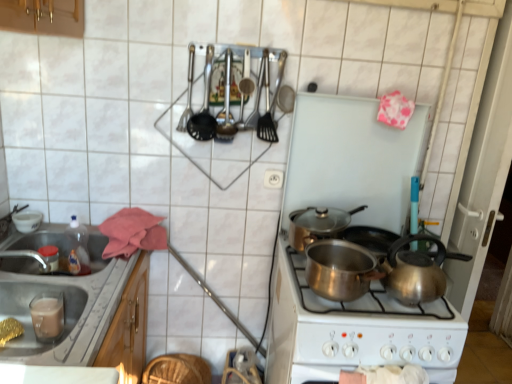
Question: From their relative heights in the image, would you say shiny metallic kettle at center right is taller or shorter than satin silver pot at center, which appears as the 1th kitchen appliance when viewed from the front?

Choices:
 (A) short
 (B) tall

Answer: (B)

Question: Is shiny metallic kettle at center right wider or thinner than satin silver pot at center, the 2th kitchen appliance from the top?

Choices:
 (A) thin
 (B) wide

Answer: (A)

Question: Estimate the real-world distances between objects in this image. Which object is farther from the golden textured bread at lower left?

Choices:
 (A) satin silver pot at center, arranged as the 1th kitchen appliance when ordered from the bottom
 (B) white plastic electric outlet at center
 (C) metallic stainless steel sink at lower left
 (D) shiny silver pot at center, the 2th kitchen appliance when ordered from front to back
 (E) shiny metallic kettle at center right

Answer: (E)

Question: Which object is positioned closest to the shiny metallic kettle at center right?

Choices:
 (A) metallic stainless steel sink at lower left
 (B) satin silver pot at center, which appears as the 1th kitchen appliance when viewed from the front
 (C) golden textured bread at lower left
 (D) shiny silver pot at center, the first kitchen appliance viewed from the back
 (E) white plastic electric outlet at center

Answer: (B)